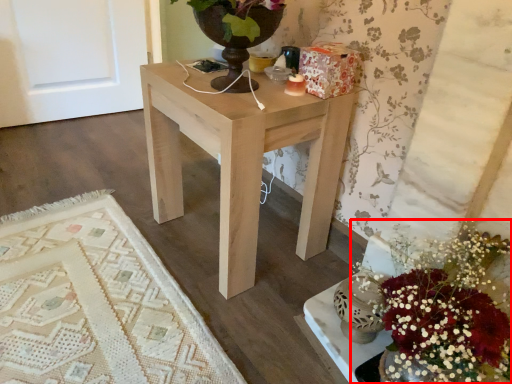
Question: From the image's perspective, what is the correct spatial positioning of flower (annotated by the red box) in reference to table?

Choices:
 (A) below
 (B) above

Answer: (A)